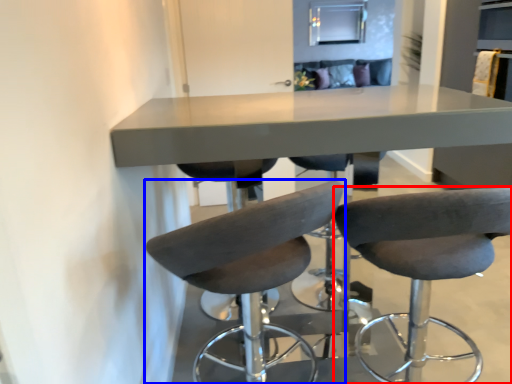
Question: Which of the following is the farthest to the observer, chair (highlighted by a red box) or chair (highlighted by a blue box)?

Choices:
 (A) chair
 (B) chair

Answer: (A)